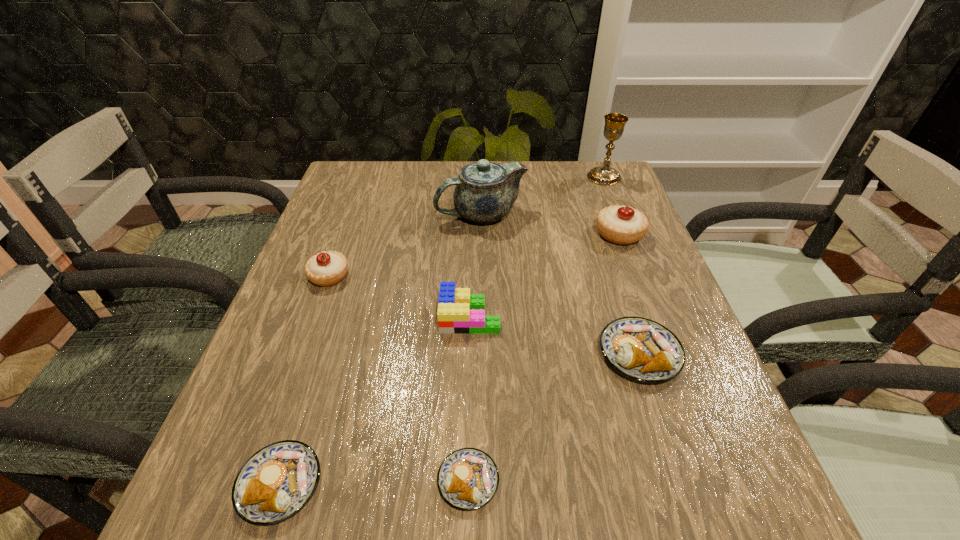
You are a GUI agent. You are given a task and a screenshot of the screen. Output one action in this format:
    pyautogui.click(x=<x>, y=<y>)
    Task: Click on the farthest object
    
    Given the screenshot: What is the action you would take?
    pyautogui.click(x=614, y=126)

This screenshot has height=540, width=960. I want to click on chinaware, so click(x=485, y=191).

The height and width of the screenshot is (540, 960). What are the coordinates of `the sixth shortest object` in the screenshot? It's located at (622, 225).

You are a GUI agent. You are given a task and a screenshot of the screen. Output one action in this format:
    pyautogui.click(x=<x>, y=<y>)
    Task: Click on the right beige pastry
    This screenshot has height=540, width=960.
    Given the screenshot: What is the action you would take?
    pyautogui.click(x=622, y=225)

Locate an element on the screen. Image resolution: width=960 pixels, height=540 pixels. the fourth shortest pastry is located at coordinates (327, 268).

At what (x,y) coordinates should I click in order to perform the action: click on the nearer beige pastry. Please return your answer as a coordinate pair (x, y). The width and height of the screenshot is (960, 540). Looking at the image, I should click on (327, 268).

Locate an element on the screen. The height and width of the screenshot is (540, 960). green Lego is located at coordinates [x=459, y=312].

The image size is (960, 540). Identify the location of the farthest brown pastry. (639, 348).

The height and width of the screenshot is (540, 960). I want to click on the rightmost brown pastry, so click(639, 348).

Locate an element on the screen. The height and width of the screenshot is (540, 960). the leftmost brown pastry is located at coordinates tap(277, 481).